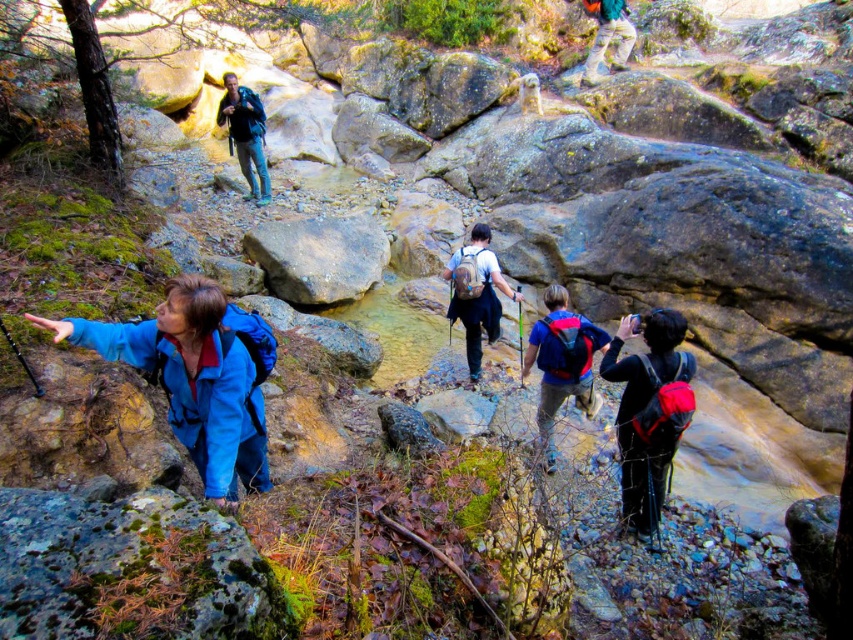
Is blue fabric jacket at lower left taller than matte blue backpack at center?

In fact, blue fabric jacket at lower left may be shorter than matte blue backpack at center.

Can you confirm if blue fabric jacket at lower left is positioned below matte blue backpack at center?

Actually, blue fabric jacket at lower left is above matte blue backpack at center.

Which is behind, point (225, 483) or point (560, 372)?

Point (560, 372)

Locate an element on the screen. The height and width of the screenshot is (640, 853). blue fabric jacket at lower left is located at coordinates (196, 376).

Does point (480, 304) lie behind point (236, 154)?

No, it is in front of (236, 154).

Where is `matte brown backpack at center`? Image resolution: width=853 pixels, height=640 pixels. matte brown backpack at center is located at coordinates (476, 292).

Between point (498, 305) and point (260, 204), which one is positioned behind?

The point (260, 204) is more distant.

This screenshot has width=853, height=640. In order to click on matte brown backpack at center in this screenshot , I will do `click(476, 292)`.

Is matte blue backpack at center thinner than matte black backpack at upper center?

Yes.

Between point (596, 346) and point (247, 141), which one is positioned in front?

Point (596, 346) is in front.

You are a GUI agent. You are given a task and a screenshot of the screen. Output one action in this format:
    pyautogui.click(x=<x>, y=<y>)
    Task: Click on the matte blue backpack at center
    The height and width of the screenshot is (640, 853).
    Given the screenshot: What is the action you would take?
    pyautogui.click(x=561, y=362)